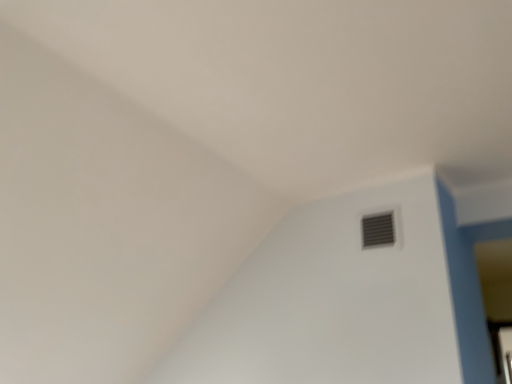
Image resolution: width=512 pixels, height=384 pixels. I want to click on matte gray vent at upper right, so click(378, 230).

Describe the element at coordinates (378, 230) in the screenshot. I see `matte gray vent at upper right` at that location.

You are a GUI agent. You are given a task and a screenshot of the screen. Output one action in this format:
    pyautogui.click(x=<x>, y=<y>)
    Task: Click on the matte gray vent at upper right
    
    Given the screenshot: What is the action you would take?
    pyautogui.click(x=378, y=230)